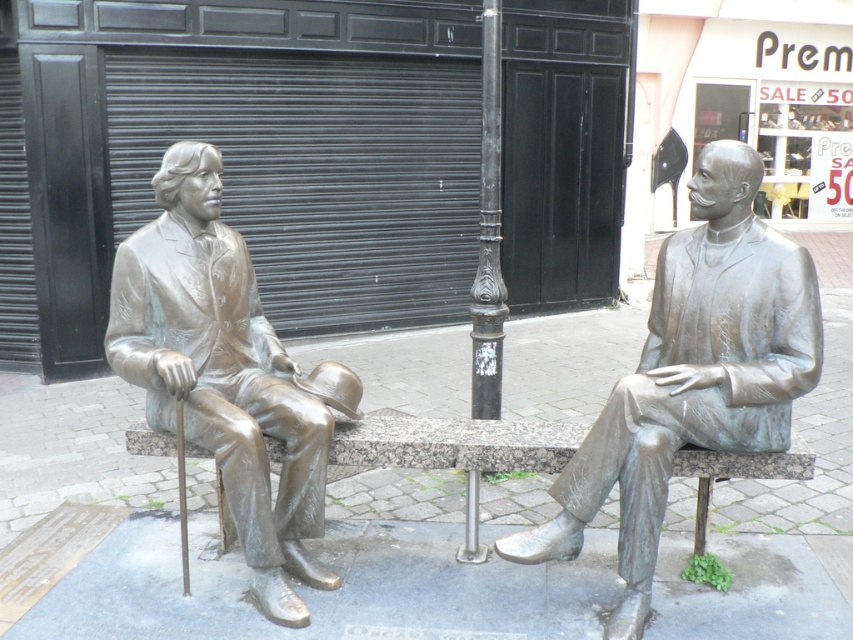
Question: Based on their relative distances, which object is nearer to the bronze stone bench at center?

Choices:
 (A) bronze statue at right
 (B) bronze statue at left

Answer: (B)

Question: Is bronze statue at left further to the viewer compared to black cast iron pole at center?

Choices:
 (A) yes
 (B) no

Answer: (B)

Question: Where is bronze statue at right located in relation to bronze statue at left in the image?

Choices:
 (A) below
 (B) above

Answer: (A)

Question: Which is nearer to the black cast iron pole at center?

Choices:
 (A) bronze stone bench at center
 (B) bronze statue at left

Answer: (A)

Question: Among these objects, which one is farthest from the camera?

Choices:
 (A) bronze statue at left
 (B) bronze stone bench at center
 (C) bronze statue at right

Answer: (B)

Question: Is bronze statue at right above bronze stone bench at center?

Choices:
 (A) yes
 (B) no

Answer: (A)